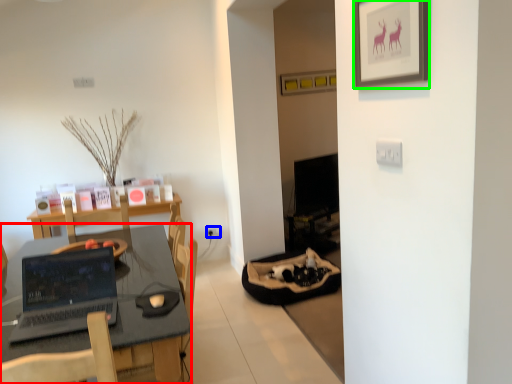
Question: Which object is positioned farthest from desk (highlighted by a red box)? Select from electric outlet (highlighted by a blue box) and picture frame (highlighted by a green box).

Choices:
 (A) electric outlet
 (B) picture frame

Answer: (A)